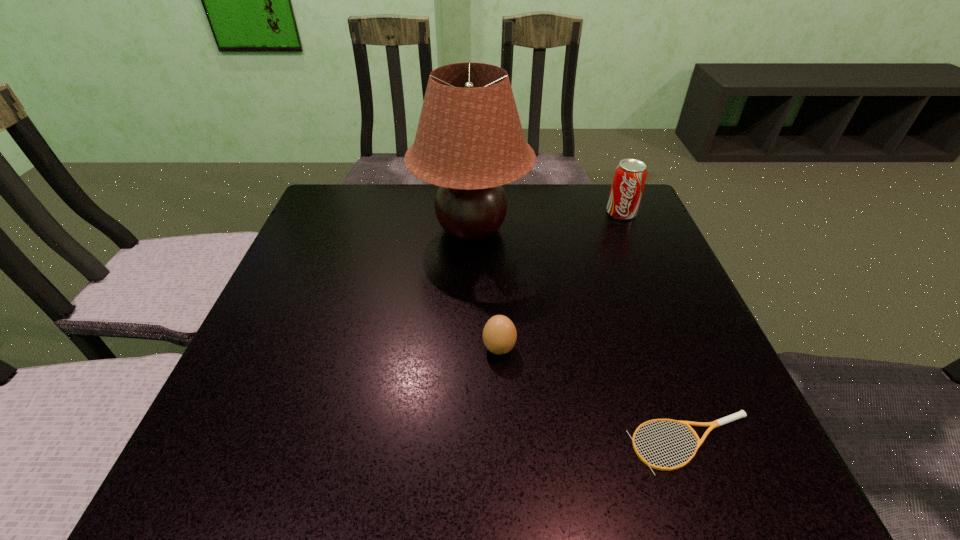
I want to click on empty location between the tallest object and the third farthest object, so click(x=485, y=289).

Identify which object is the second closest to the shortest object. Please provide its 2D coordinates. Your answer should be formatted as a tuple, i.e. [(x, y)], where the tuple contains the x and y coordinates of a point satisfying the conditions above.

[(469, 141)]

Select which object appears as the closest to the tallest object. Please provide its 2D coordinates. Your answer should be formatted as a tuple, i.e. [(x, y)], where the tuple contains the x and y coordinates of a point satisfying the conditions above.

[(499, 335)]

Find the location of `vacant position in the image that satisfies the following two spatial constraints: 1. on the front-facing side of the lampshade; 2. on the right side of the tennis racket`. vacant position in the image that satisfies the following two spatial constraints: 1. on the front-facing side of the lampshade; 2. on the right side of the tennis racket is located at coordinates (466, 443).

What are the coordinates of `vacant region that satisfies the following two spatial constraints: 1. on the back side of the soda can; 2. on the left side of the boiled egg` in the screenshot? It's located at (493, 213).

Locate an element on the screen. vacant space that satisfies the following two spatial constraints: 1. on the front-facing side of the boiled egg; 2. on the left side of the lampshade is located at coordinates (468, 348).

Locate an element on the screen. The width and height of the screenshot is (960, 540). free spot that satisfies the following two spatial constraints: 1. on the front-facing side of the tallest object; 2. on the left side of the boiled egg is located at coordinates (468, 348).

The image size is (960, 540). In order to click on free space that satisfies the following two spatial constraints: 1. on the back side of the nearest object; 2. on the front-facing side of the tallest object in this screenshot , I will do `click(612, 229)`.

Where is `free space that satisfies the following two spatial constraints: 1. on the front-facing side of the boiled egg; 2. on the right side of the tallest object`? Image resolution: width=960 pixels, height=540 pixels. free space that satisfies the following two spatial constraints: 1. on the front-facing side of the boiled egg; 2. on the right side of the tallest object is located at coordinates (468, 348).

You are a GUI agent. You are given a task and a screenshot of the screen. Output one action in this format:
    pyautogui.click(x=<x>, y=<y>)
    Task: Click on the free spot that satisfies the following two spatial constraints: 1. on the front-facing side of the lampshade; 2. on the left side of the second nearest object
    Image resolution: width=960 pixels, height=540 pixels.
    Given the screenshot: What is the action you would take?
    pyautogui.click(x=468, y=348)